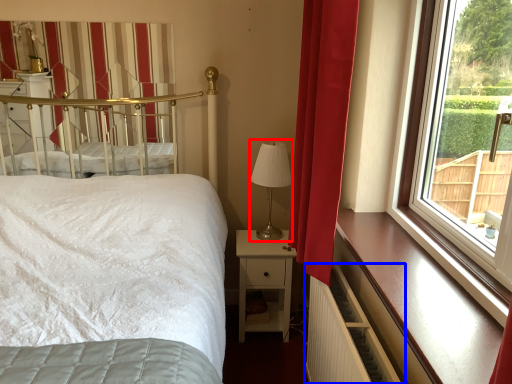
Question: Which point is further to the camera, table lamp (highlighted by a red box) or balustrade (highlighted by a blue box)?

Choices:
 (A) table lamp
 (B) balustrade

Answer: (A)